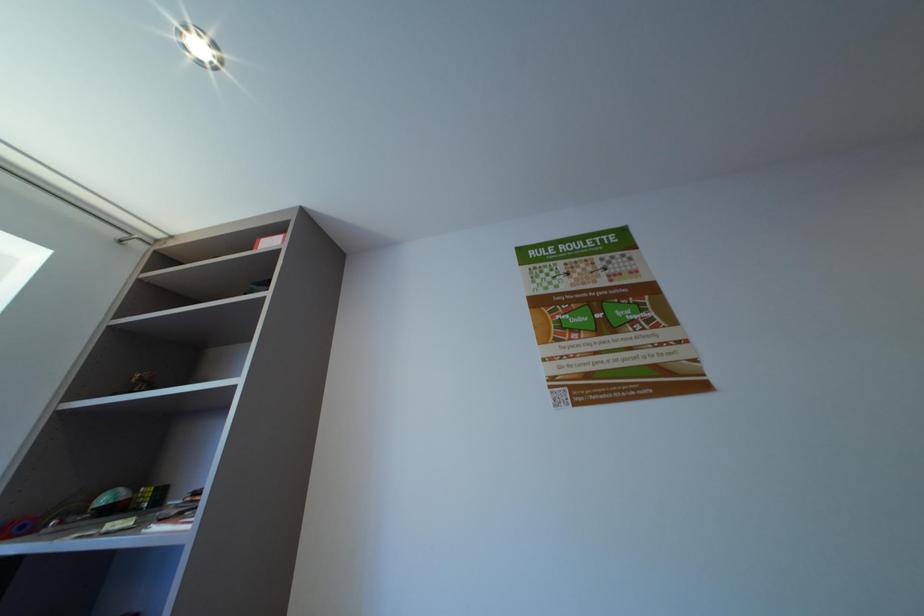
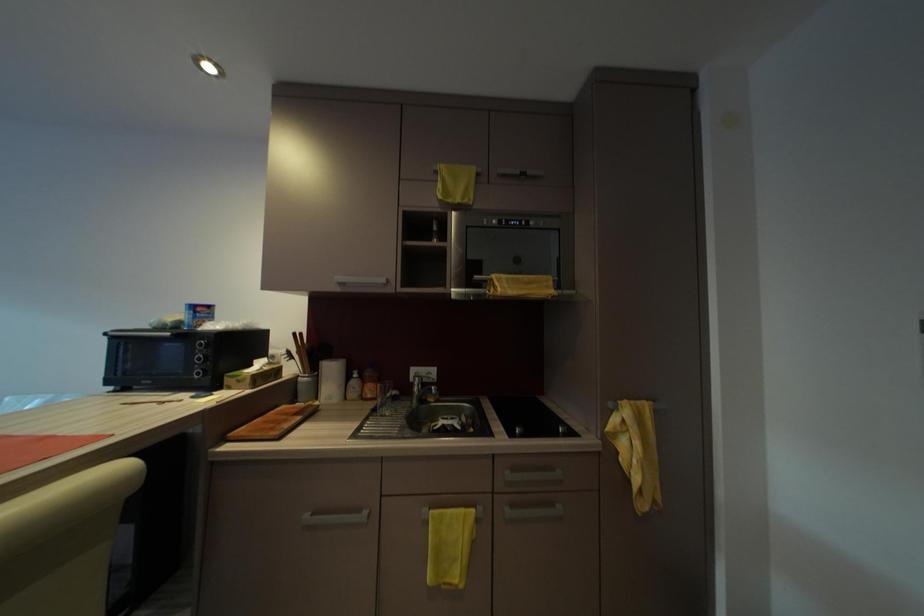
Question: In a continuous first-person perspective shot, in which direction is the camera moving?

Choices:
 (A) Left
 (B) Right
 (C) Forward
 (D) Backward

Answer: (B)